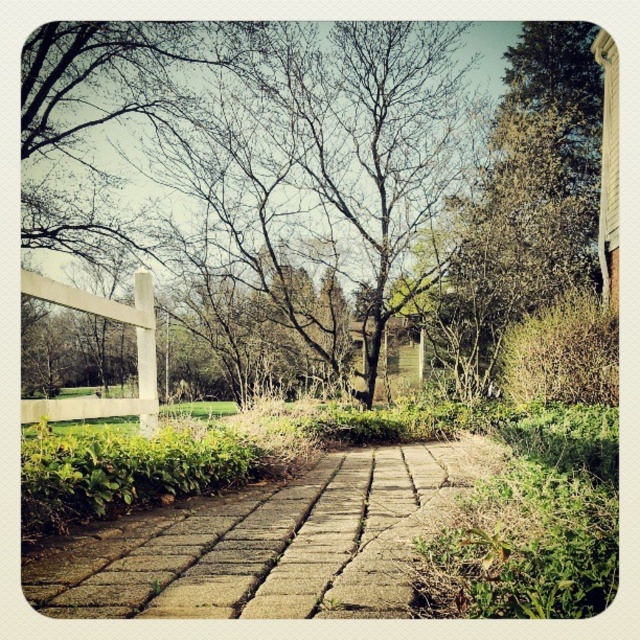
You are standing at the starting point of the pathway in the garden scene. There are two points marked on the image, point 1 at coordinates (582, 109) and point 2 at (80, 588). If you want to take a photo that includes both points, which point should you move towards to ensure both are in frame?

You should move towards point 2 at (80, 588) because point 1 at (582, 109) is further away from the camera. Moving towards the closer point will help keep both points within the camera frame.

You are a gardener planning to install a new sprinkler system along the brown stone path at center. You need to ensure that the sprinkler heads will not interfere with the bare branches at center. Based on the scene description, will the sprinkler heads, which are 10 cm tall, be able to spray water without obstruction from the branches?

The bare branches at center are above the brown stone path at center, so the sprinkler heads at 10 cm tall may be obstructed by the branches. Adjust the sprinkler placement or height to avoid interference.